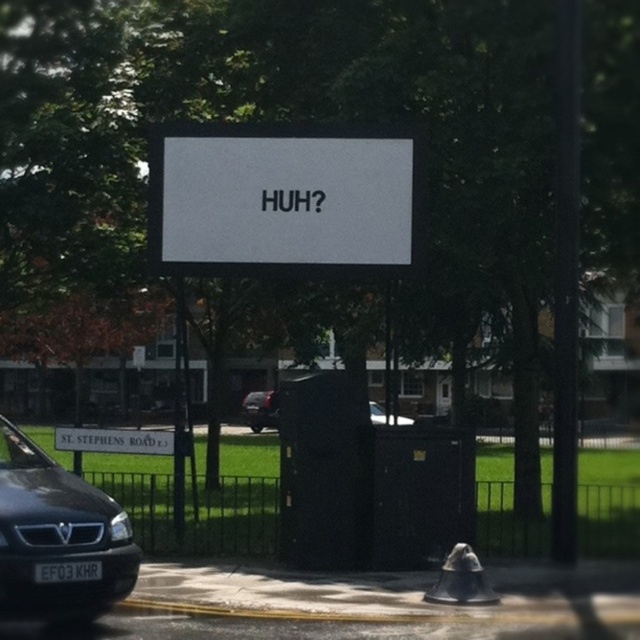
Question: Which point appears farthest from the camera in this image?

Choices:
 (A) (236, 208)
 (B) (65, 541)

Answer: (A)

Question: Considering the relative positions of white matte sign at center and black matte car at center in the image provided, where is white matte sign at center located with respect to black matte car at center?

Choices:
 (A) above
 (B) below

Answer: (A)

Question: Is white matte sign at center to the left of shiny black car at center from the viewer's perspective?

Choices:
 (A) no
 (B) yes

Answer: (A)

Question: Among these points, which one is farthest from the camera?

Choices:
 (A) (394, 422)
 (B) (51, 618)
 (C) (243, 177)
 (D) (260, 422)

Answer: (D)

Question: Which of the following is the closest to the observer?

Choices:
 (A) (358, 170)
 (B) (243, 403)
 (C) (61, 525)

Answer: (C)

Question: Is white matte sign at center further to the viewer compared to shiny black car at center?

Choices:
 (A) no
 (B) yes

Answer: (A)